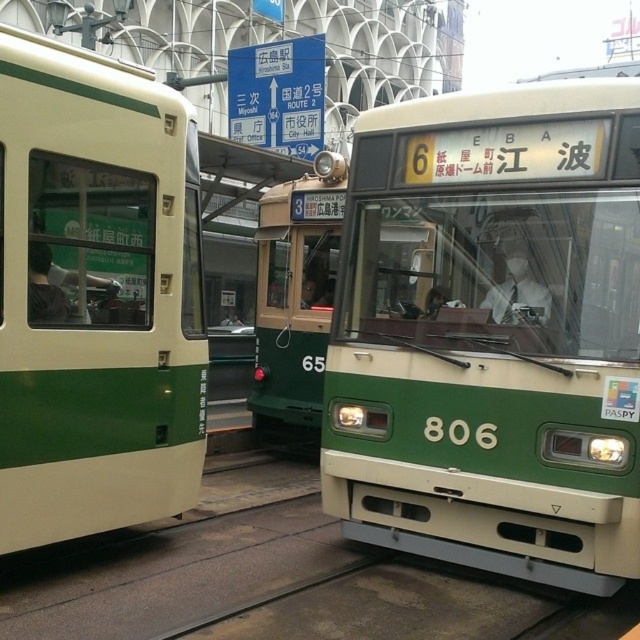
Consider the image. You are a passenger at the tram station and want to board the larger tram. Which one should you approach, the green matte train at left or the green matte train at center?

The green matte train at center is larger than the green matte train at left, so you should approach the green matte train at center.

You are a passenger waiting at the Hiroshima tram station. You see the green matte tram at center and the green matte train at center. Which one is closer to the platform edge?

The green matte tram at center is closer to the platform edge because it is positioned to the right of the green matte train at center, which is further back.